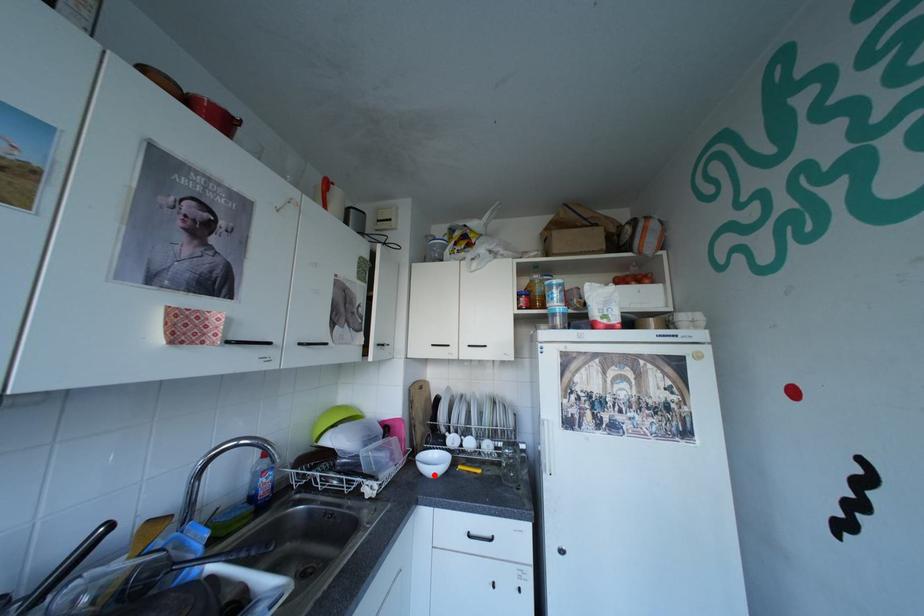
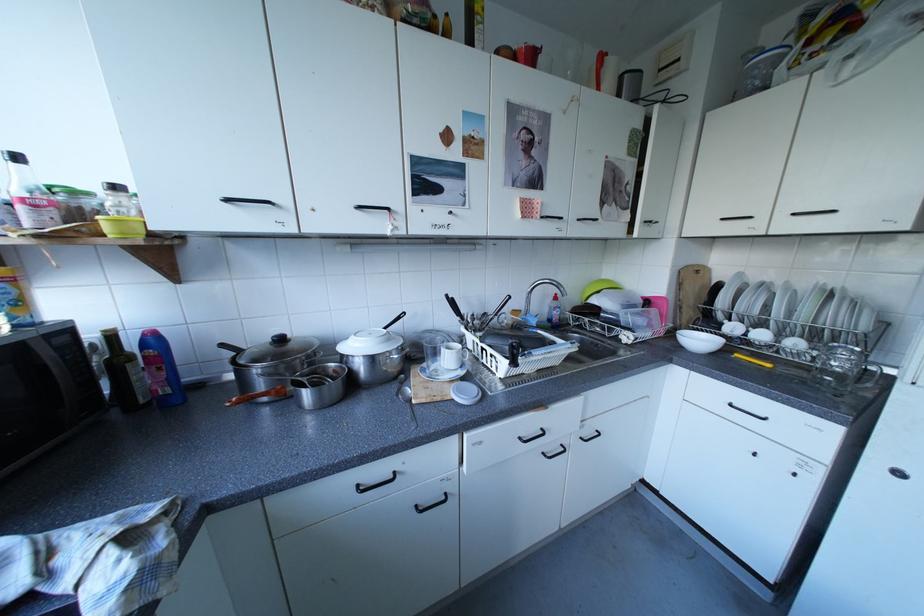
Locate, in the second image, the point that corresponds to the highlighted location in the first image.

(694, 347)